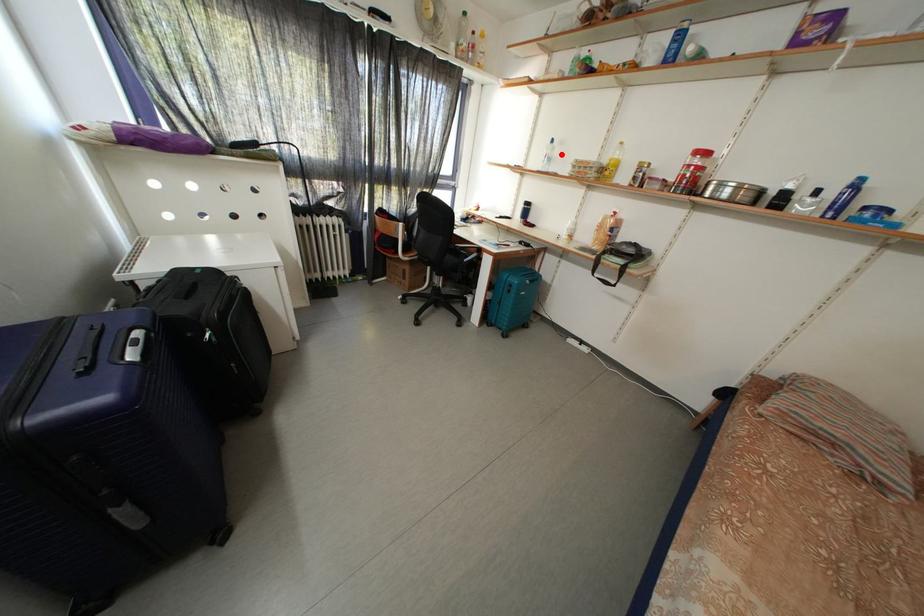
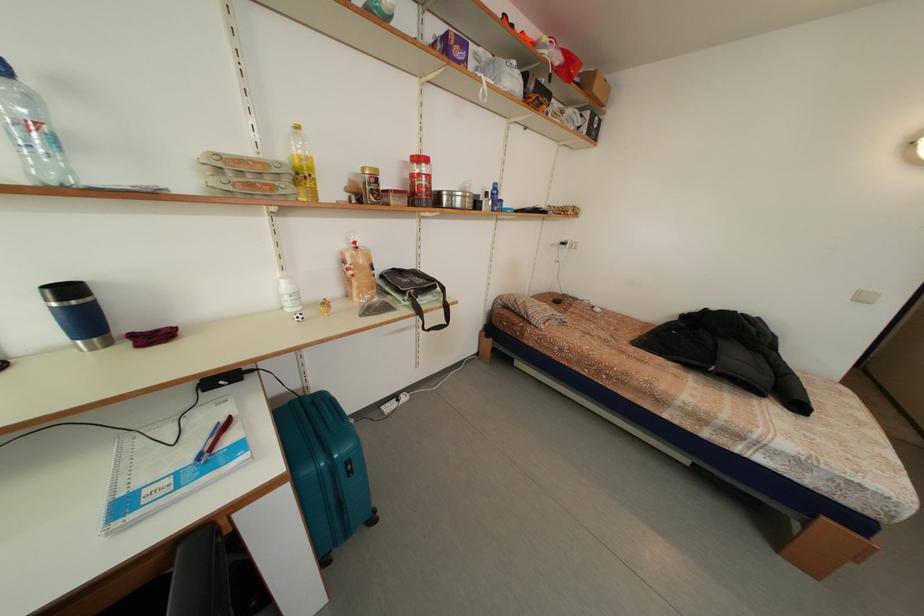
Question: I am providing you with two images of the same scene from different viewpoints. A red point is shown in image1. For the corresponding object point in image2, is it positioned nearer or farther from the camera?

Choices:
 (A) Nearer
 (B) Farther

Answer: (B)